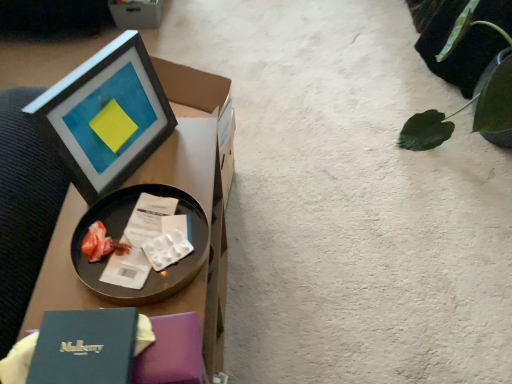
Locate an element on the screen. free region under metallic tray at left (from a real-world perspective) is located at coordinates (145, 250).